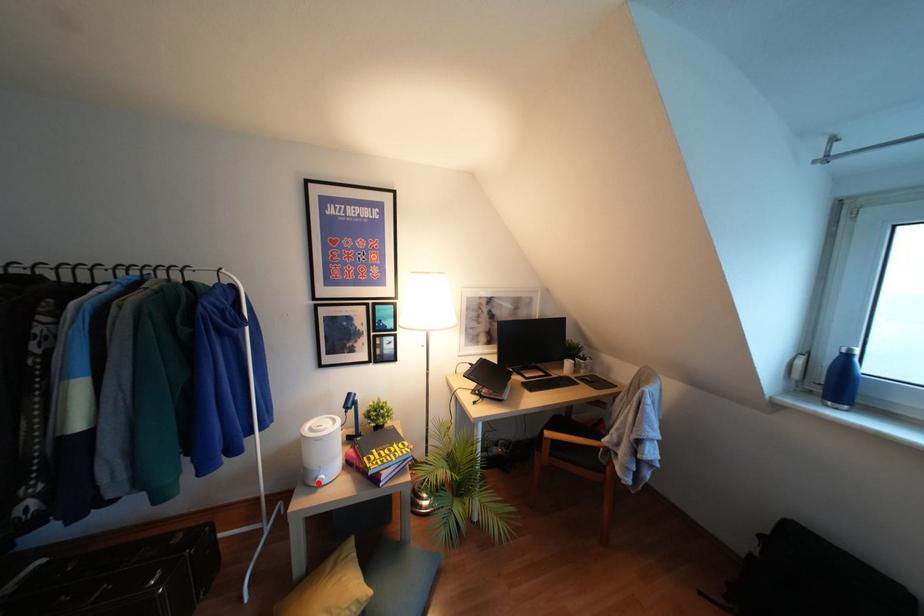
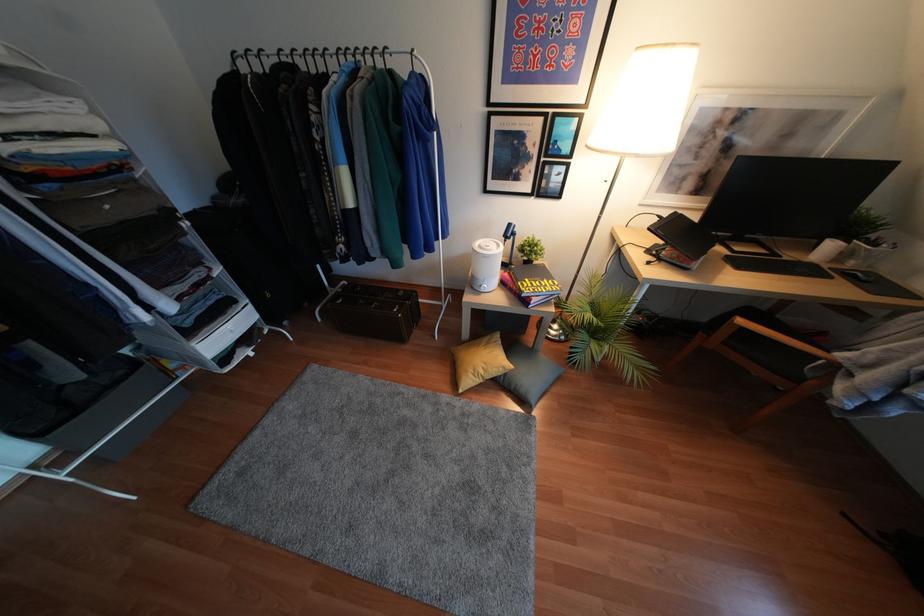
Where in the second image is the point corresponding to the highlighted location from the first image?

(481, 290)